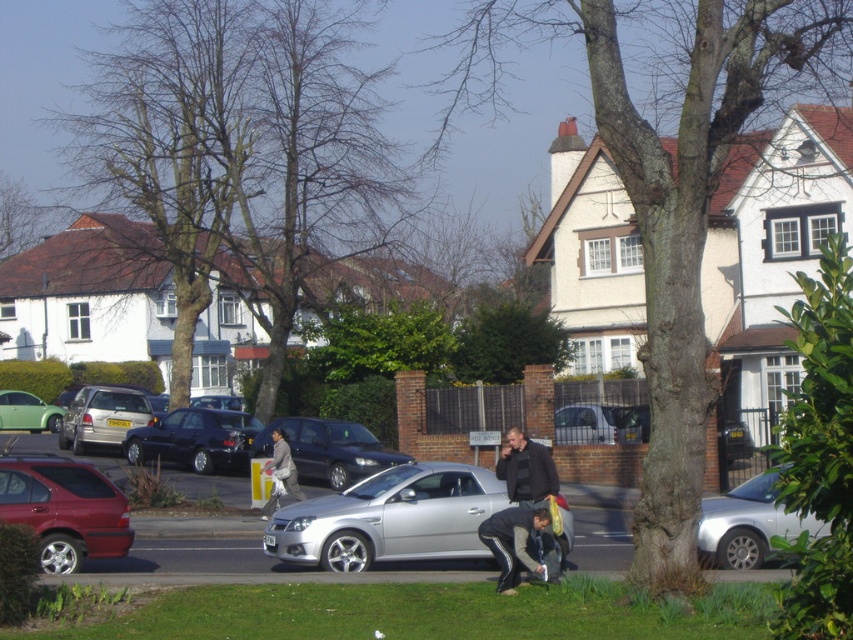
Does silver metallic hatchback at center-left appear over silver metallic van at center?

No.

Does silver metallic hatchback at center-left have a smaller size compared to silver metallic van at center?

Yes.

Between point (138, 403) and point (646, 426), which one is positioned behind?

The point (138, 403) is behind.

Locate an element on the screen. This screenshot has width=853, height=640. silver metallic hatchback at center-left is located at coordinates click(102, 417).

Does satin black car at center appear on the right side of matte green car at left?

Correct, you'll find satin black car at center to the right of matte green car at left.

Does satin black car at center have a larger size compared to matte green car at left?

Yes.

Is point (335, 420) behind point (15, 413)?

No.

You are a GUI agent. You are given a task and a screenshot of the screen. Output one action in this format:
    pyautogui.click(x=<x>, y=<y>)
    Task: Click on the satin black car at center
    This screenshot has height=640, width=853.
    Given the screenshot: What is the action you would take?
    pyautogui.click(x=329, y=449)

Does metallic red car at left appear on the right side of dark gray fabric jacket at lower center?

In fact, metallic red car at left is to the left of dark gray fabric jacket at lower center.

Where is `metallic red car at left`? This screenshot has width=853, height=640. metallic red car at left is located at coordinates (64, 509).